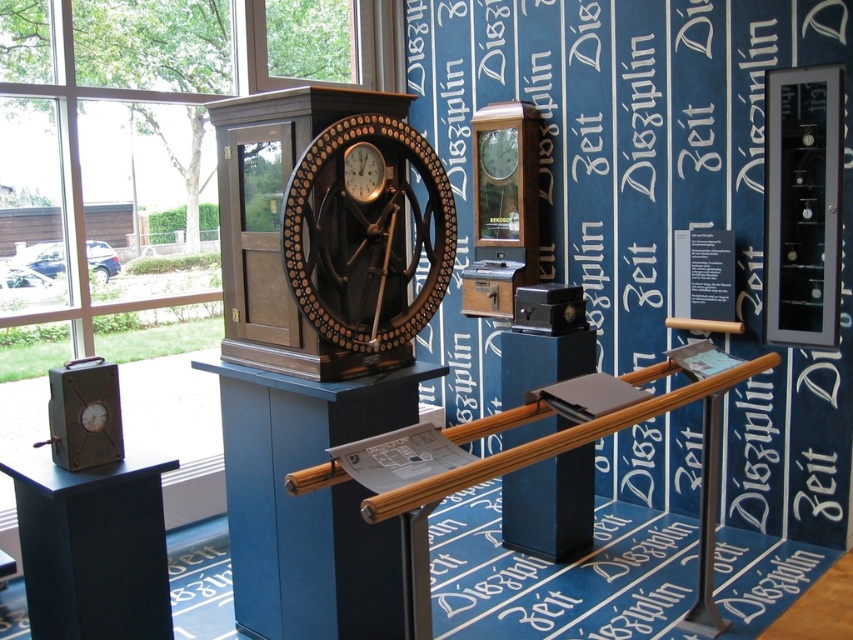
You are standing in the museum exhibit and want to locate the matte black panel at center. According to the coordinates provided, where would you find it?

The matte black panel at center is located at coordinates point (550, 506).

You are a visitor standing in front of the museum exhibit. You notice the matte black panel at center and the matte brown clock at center. Which object is closer to you?

The matte black panel at center is closer to you because it is further to the viewer than the matte brown clock at center.